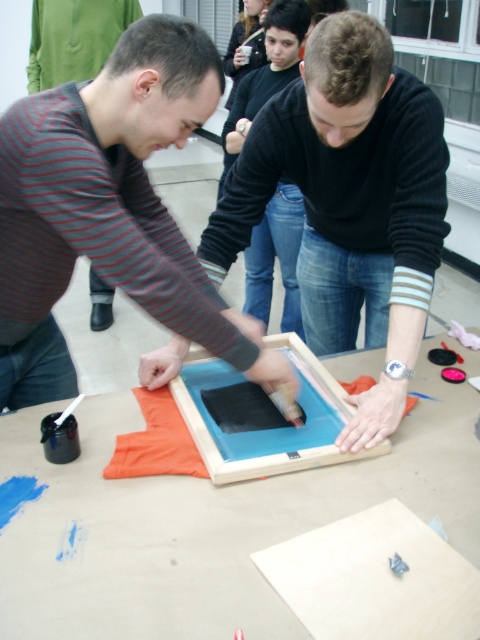
Question: Which of the following is the closest to the observer?

Choices:
 (A) striped cotton shirt at center
 (B) wooden table at center

Answer: (B)

Question: Is wooden table at center wider than striped cotton shirt at center?

Choices:
 (A) yes
 (B) no

Answer: (A)

Question: Which point is closer to the camera taking this photo?

Choices:
 (A) (9, 115)
 (B) (456, 404)

Answer: (A)

Question: Can you confirm if wooden table at center is bigger than striped cotton shirt at center?

Choices:
 (A) yes
 (B) no

Answer: (A)

Question: Can you confirm if wooden table at center is positioned above striped cotton shirt at center?

Choices:
 (A) yes
 (B) no

Answer: (B)